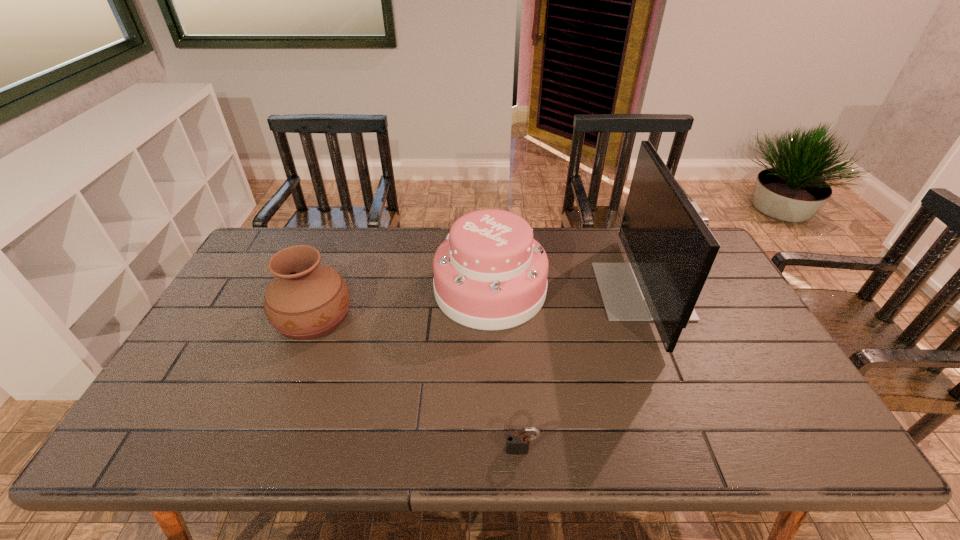
Where is `the rightmost object`? The width and height of the screenshot is (960, 540). the rightmost object is located at coordinates (671, 250).

At what (x,y) coordinates should I click in order to perform the action: click on computer monitor. Please return your answer as a coordinate pair (x, y). The width and height of the screenshot is (960, 540). Looking at the image, I should click on (671, 250).

Identify the location of cake. This screenshot has width=960, height=540. (489, 273).

Locate an element on the screen. The height and width of the screenshot is (540, 960). urn is located at coordinates (306, 300).

Where is `the shortest object`? The height and width of the screenshot is (540, 960). the shortest object is located at coordinates (517, 444).

Where is `the nearest object`? The width and height of the screenshot is (960, 540). the nearest object is located at coordinates (517, 444).

Identify the location of vacant space located on the screen of the rightmost object. The image size is (960, 540). (524, 291).

This screenshot has height=540, width=960. I want to click on free space located 0.120m on the screen of the rightmost object, so click(x=561, y=291).

Image resolution: width=960 pixels, height=540 pixels. What are the coordinates of `vacant space positioned on the screen of the rightmost object` in the screenshot? It's located at (505, 291).

Image resolution: width=960 pixels, height=540 pixels. Identify the location of vacant space situated on the left of the cake. (321, 289).